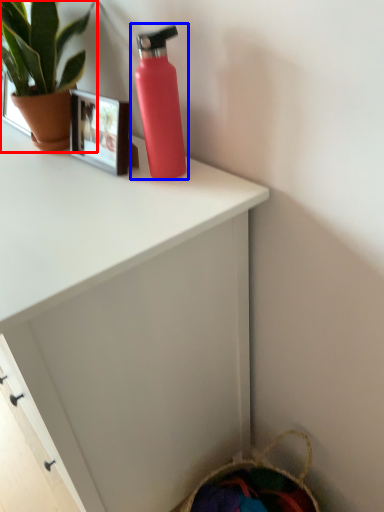
Question: Among these objects, which one is farthest to the camera, houseplant (highlighted by a red box) or bottle (highlighted by a blue box)?

Choices:
 (A) houseplant
 (B) bottle

Answer: (A)